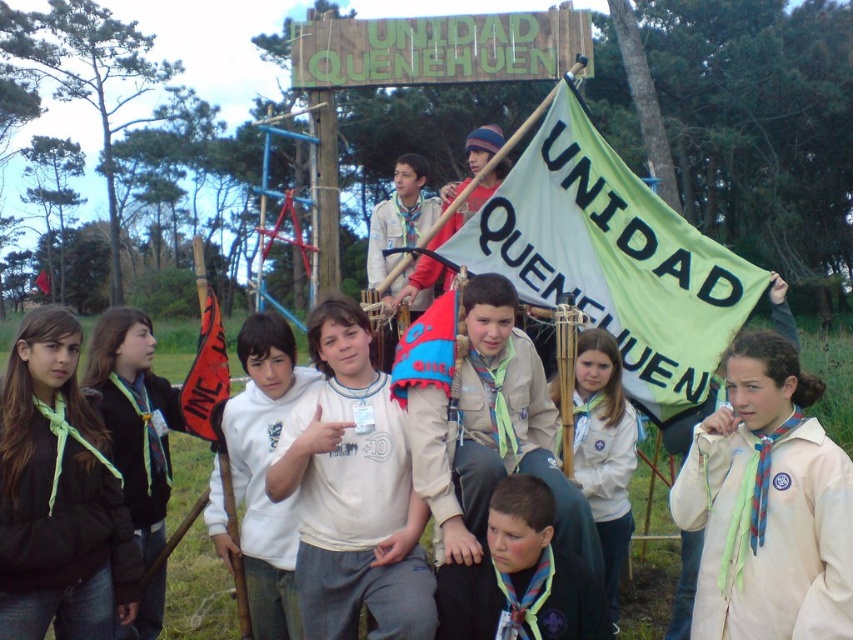
You are a photographer trying to capture a clear shot of the UNIDAD QUENEHUEN sign. You notice the green fabric flag at center and the white matte shirt at center are blocking the view. Which object is taller and thus more likely to obstruct the sign?

The green fabric flag at center is taller than the white matte shirt at center, so it is more likely to obstruct the sign.

You are standing at the campsite and want to hand a small gift to the person holding the green fabric flag at center. If you can throw a gift up to 5 meters, can you reach them?

The green fabric flag at center is 7.51 meters away from the viewer, which is beyond the 5 meter throwing range. You cannot reach them by throwing.

In the scene shown: You are a photographer trying to capture a clear photo of the white cotton hoodie at center. However, the white matte shirt at center is blocking your view. Based on the scene description, can you adjust your position to take the photo without moving the subjects?

The white matte shirt at center is in front of the white cotton hoodie at center, so you can move to the side to get an angle where the white cotton hoodie at center is visible beyond the white matte shirt at center.